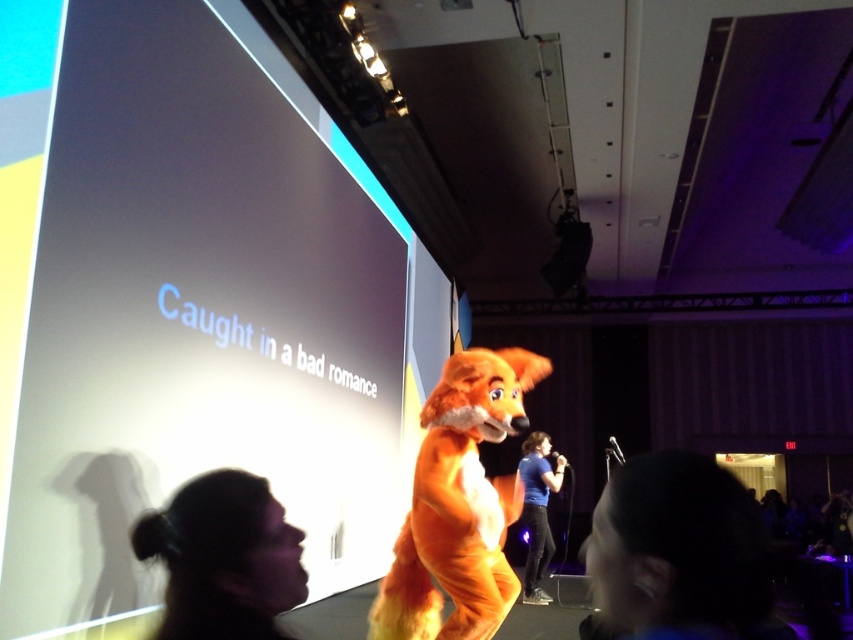
You are organizing a photo shoot in the venue and need to position a camera 15 feet away from the dark hair at lower right. Can you place the camera near the blue fabric shirt at center?

The distance between dark hair at lower right and blue fabric shirt at center is 16.71 feet, so placing the camera near the blue fabric shirt at center would be approximately 16.71 feet away from the dark hair at lower right, which is slightly more than the desired 15 feet. Therefore, the camera placement would be acceptable if a slight adjustment is made, but not exact.

You are a photographer at the event and need to capture a closeup of the dark hair at lower right without the fox costume in the background. The camera has a 100mm lens with a depth of field that can blur objects beyond 28 inches away from the focus point. Can you achieve this?

Yes, since the dark hair at lower right is 28.33 inches away from the fox costume. By focusing on the dark hair at lower right and using the 100mm lens, the fox costume will be just beyond the 28 inches depth of field range, resulting in a blurred background effect.